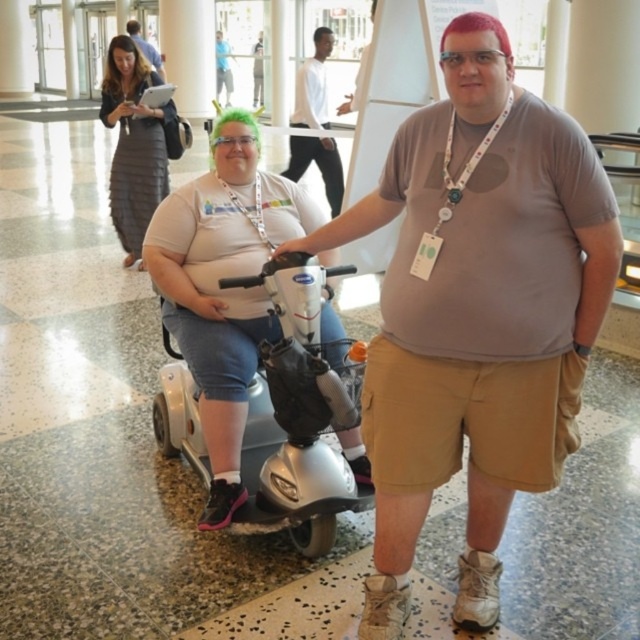
Can you confirm if brown straight hair at upper left is positioned to the right of matte black laptop at upper left?

Indeed, brown straight hair at upper left is positioned on the right side of matte black laptop at upper left.

Is point (141, 67) positioned before point (147, 49)?

That is True.

Where is `brown straight hair at upper left`? brown straight hair at upper left is located at coordinates (118, 68).

Can you confirm if matte gray shirt at center is positioned below silver metallic mobility scooter at center?

Actually, matte gray shirt at center is above silver metallic mobility scooter at center.

Is matte gray shirt at center shorter than silver metallic mobility scooter at center?

No, matte gray shirt at center is not shorter than silver metallic mobility scooter at center.

Measure the distance between point [493,586] and camera.

7.21 feet

You are a GUI agent. You are given a task and a screenshot of the screen. Output one action in this format:
    pyautogui.click(x=<x>, y=<y>)
    Task: Click on the matte gray shirt at center
    
    Given the screenshot: What is the action you would take?
    pyautogui.click(x=476, y=312)

Who is more forward, (387,611) or (120,45)?

Point (387,611) is in front.

Locate an element on the screen. The image size is (640, 640). matte gray shirt at center is located at coordinates (476, 312).